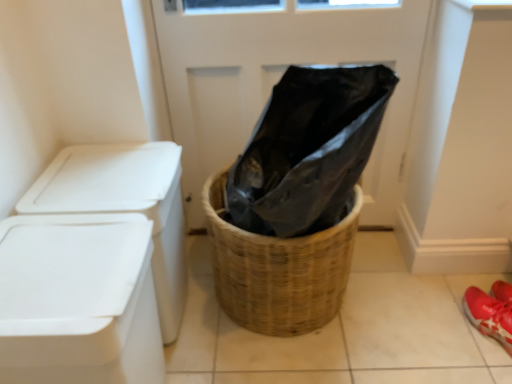
Question: Is white plastic container at left not close to white plastic container at left?

Choices:
 (A) yes
 (B) no

Answer: (B)

Question: Is white plastic container at left closer to camera compared to white plastic container at left?

Choices:
 (A) no
 (B) yes

Answer: (A)

Question: Does white plastic container at left touch white plastic container at left?

Choices:
 (A) yes
 (B) no

Answer: (B)

Question: From a real-world perspective, is white plastic container at left physically below white plastic container at left?

Choices:
 (A) yes
 (B) no

Answer: (A)

Question: Is white plastic container at left located outside white plastic container at left?

Choices:
 (A) no
 (B) yes

Answer: (B)

Question: Does white plastic container at left have a smaller size compared to white plastic container at left?

Choices:
 (A) yes
 (B) no

Answer: (A)

Question: Is black plastic bag at center smaller than white plastic container at left?

Choices:
 (A) yes
 (B) no

Answer: (B)

Question: Can you confirm if black plastic bag at center is taller than white plastic container at left?

Choices:
 (A) yes
 (B) no

Answer: (A)

Question: Can you confirm if black plastic bag at center is thinner than white plastic container at left?

Choices:
 (A) yes
 (B) no

Answer: (A)

Question: From the image's perspective, is black plastic bag at center above white plastic container at left?

Choices:
 (A) yes
 (B) no

Answer: (A)

Question: Is black plastic bag at center further to camera compared to white plastic container at left?

Choices:
 (A) yes
 (B) no

Answer: (A)

Question: Is white plastic container at left located within black plastic bag at center?

Choices:
 (A) yes
 (B) no

Answer: (B)

Question: From a real-world perspective, is woven brown basket at center beneath white plastic container at left?

Choices:
 (A) no
 (B) yes

Answer: (B)